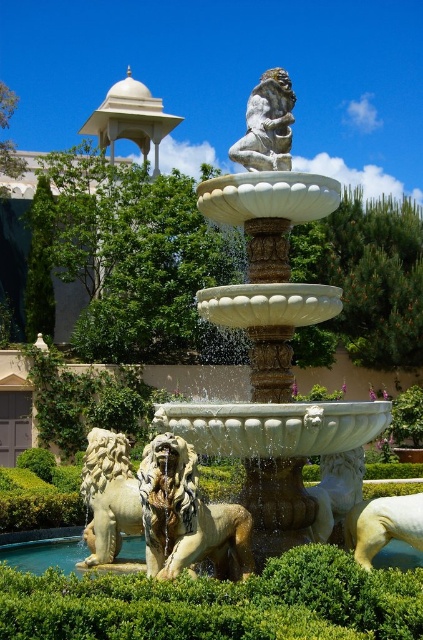
Question: Which is farther from the gray stone monkey at upper center?

Choices:
 (A) white marble lion at center
 (B) white stone lion at left

Answer: (A)

Question: Does white marble lion at center have a larger size compared to gray stone monkey at upper center?

Choices:
 (A) yes
 (B) no

Answer: (A)

Question: Which is farther from the white stone lion at left?

Choices:
 (A) white marble lion at center
 (B) gray stone monkey at upper center

Answer: (B)

Question: Is white marble lion at center bigger than gray stone monkey at upper center?

Choices:
 (A) no
 (B) yes

Answer: (B)

Question: Can you confirm if green leafy hedge at center is positioned to the left of beige marble gazebo at upper left?

Choices:
 (A) yes
 (B) no

Answer: (B)

Question: Which of the following is the closest to the observer?

Choices:
 (A) (47, 637)
 (B) (241, 145)
 (C) (109, 531)

Answer: (A)